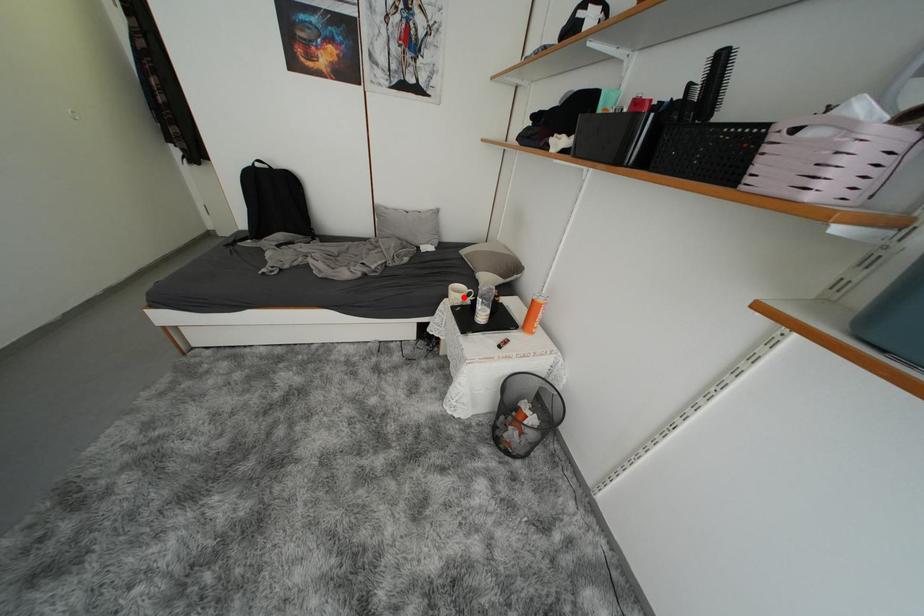
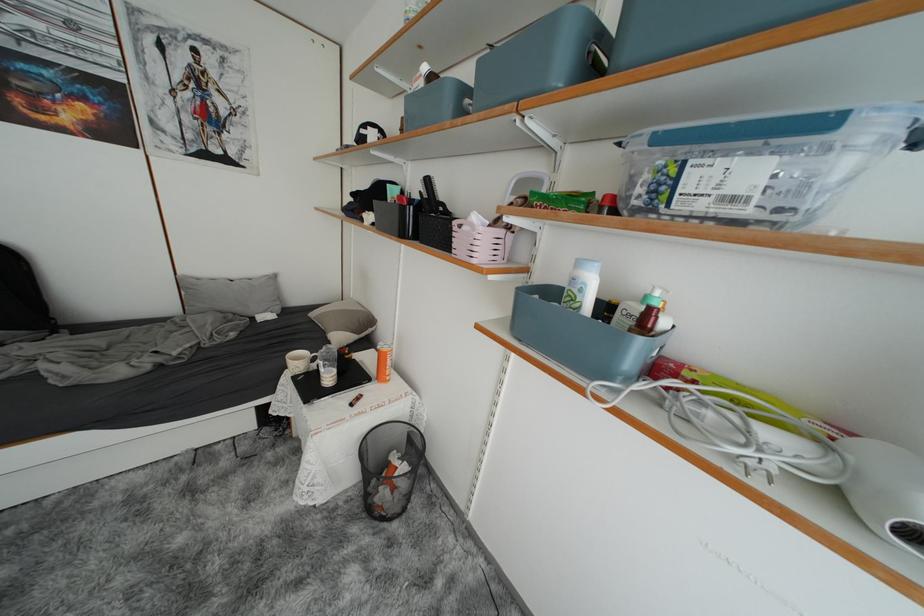
Where in the second image is the point corresponding to the highlighted location from the first image?

(305, 365)